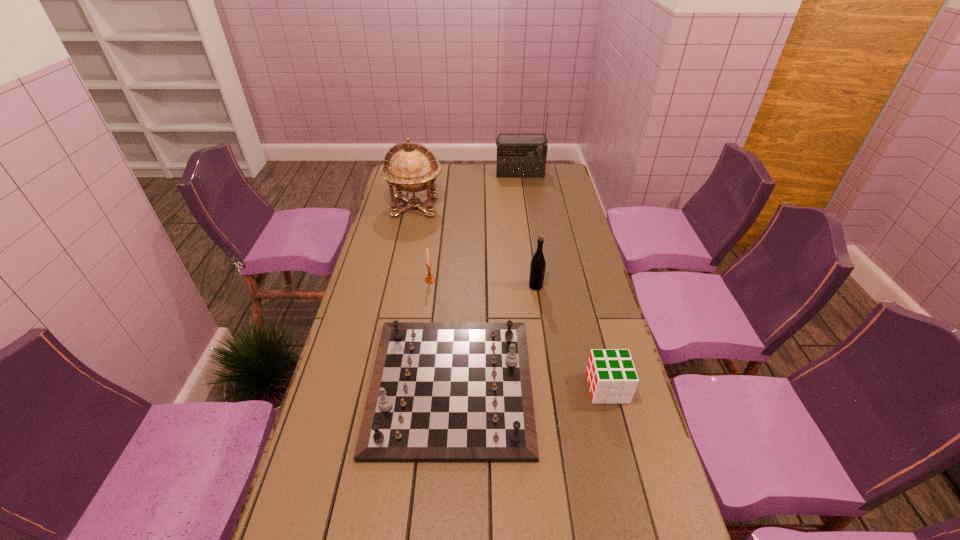
Locate an element on the screen. radio receiver is located at coordinates (516, 157).

Where is `globe`? Image resolution: width=960 pixels, height=540 pixels. globe is located at coordinates (414, 168).

Find the location of `beer bottle`. beer bottle is located at coordinates (537, 265).

Where is `candle_holder`? This screenshot has width=960, height=540. candle_holder is located at coordinates (429, 279).

Identify the location of cube. (611, 375).

This screenshot has width=960, height=540. In order to click on chessboard in this screenshot , I will do `click(440, 391)`.

Locate an element on the screen. This screenshot has height=540, width=960. free space located 0.310m on the front panel of the farthest object is located at coordinates (525, 213).

Find the location of a particular element. Image resolution: width=960 pixels, height=540 pixels. vacant space located on the front-facing side of the second farthest object is located at coordinates (410, 234).

I want to click on vacant space located 0.350m on the back of the beer bottle, so click(x=527, y=226).

What are the coordinates of `vacant region located 0.260m on the back of the candle_holder` in the screenshot? It's located at (436, 235).